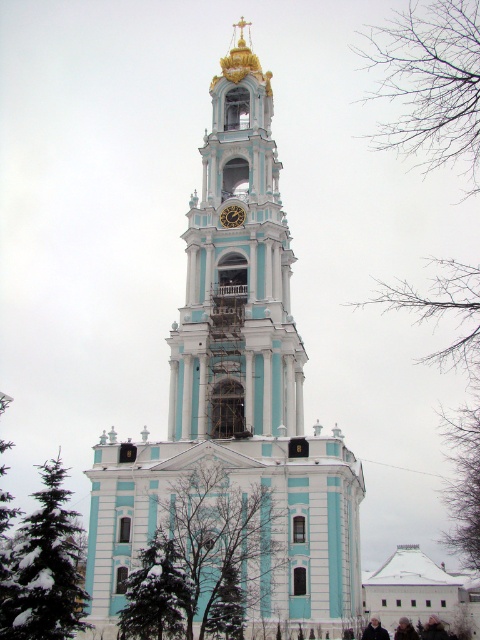
You are standing in front of the bell tower and want to know if the green leafy tree at center can block the view of the gold metallic clock at center. Based on their widths, can you determine if the tree is wider than the clock?

The green leafy tree at center might be wider than gold metallic clock at center, so there is a possibility that the tree could block the view of the clock depending on their exact positions and angles.

You are standing in front of the bell tower and notice the bare branches at lower right and the gold metallic clock at center. Which object appears wider from your vantage point?

The bare branches at lower right might be wider than the gold metallic clock at center.

You are standing in front of the bell tower and want to take a photo that includes both the bare branches at lower right and the gold metallic clock at center. Based on their positions, which object should you adjust your camera angle to include first?

The bare branches at lower right is to the right of the gold metallic clock at center, so you should adjust your camera angle to include the bare branches at lower right first since it is positioned further to the right side of the scene.